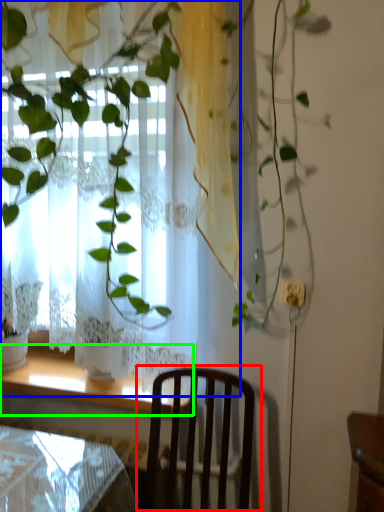
Question: Which object is positioned closest to chair (highlighted by a red box)? Select from curtain (highlighted by a blue box) and window sill (highlighted by a green box).

Choices:
 (A) curtain
 (B) window sill

Answer: (B)